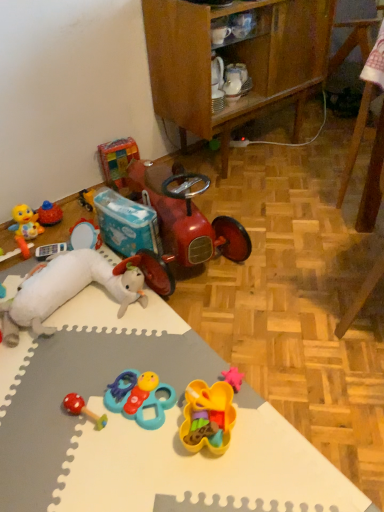
Question: Considering the positions of teal plastic toy at center, which ranks as the 3th toy in top-to-bottom order, and wooden cabinet at center in the image, is teal plastic toy at center, which ranks as the 3th toy in top-to-bottom order, taller or shorter than wooden cabinet at center?

Choices:
 (A) short
 (B) tall

Answer: (A)

Question: In terms of width, does teal plastic toy at center, which ranks as the 3th toy in top-to-bottom order, look wider or thinner when compared to wooden cabinet at center?

Choices:
 (A) thin
 (B) wide

Answer: (A)

Question: Estimate the real-world distances between objects in this image. Which object is farther from the shiny red toy car at center?

Choices:
 (A) white foam mat at lower left
 (B) wooden cabinet at center
 (C) plastic colorful blocks at upper left, which is counted as the fifth toy, starting from the bottom
 (D) translucent plastic toy at center, which is the 4th toy in top-to-bottom order
 (E) teal plastic toy at center, which is counted as the 3th toy, starting from the front

Answer: (D)

Question: Which object is positioned farthest from the rubberized red mushroom rattle at lower left, the 2th toy in the front-to-back sequence?

Choices:
 (A) shiny red toy car at center
 (B) wooden cabinet at center
 (C) white foam mat at lower left
 (D) translucent plastic toy at center, the fifth toy from the back
 (E) teal plastic toy at center, which ranks as the 3th toy in top-to-bottom order

Answer: (B)